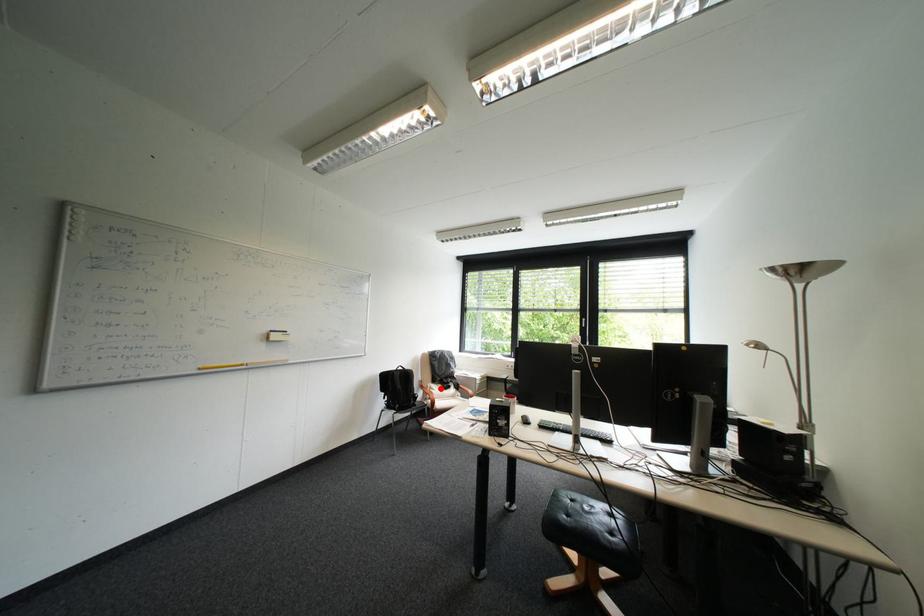
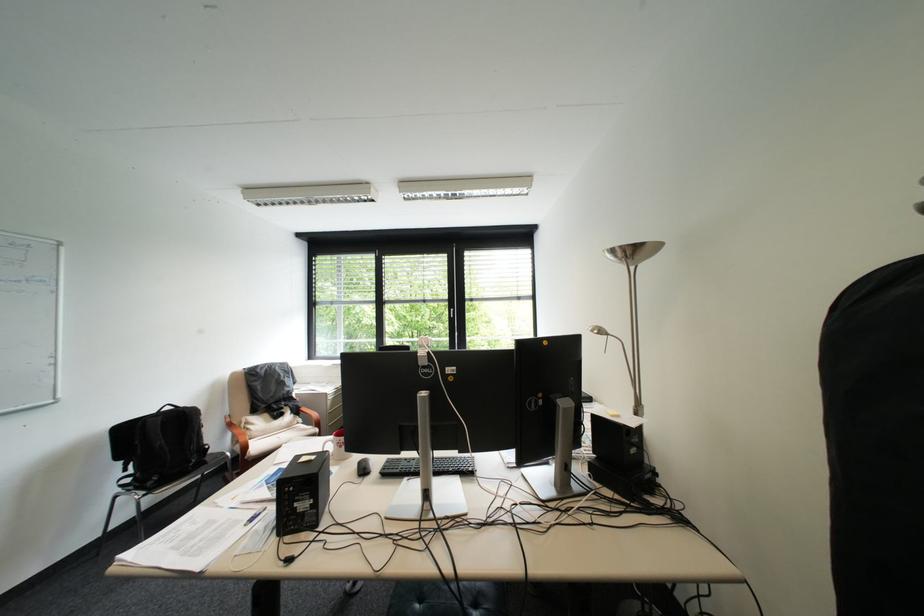
Question: I am providing you with two images of the same scene from different viewpoints. In image1, a red point is highlighted. Considering the same 3D point in image2, which of the following is correct?

Choices:
 (A) It is closer
 (B) It is farther

Answer: (A)